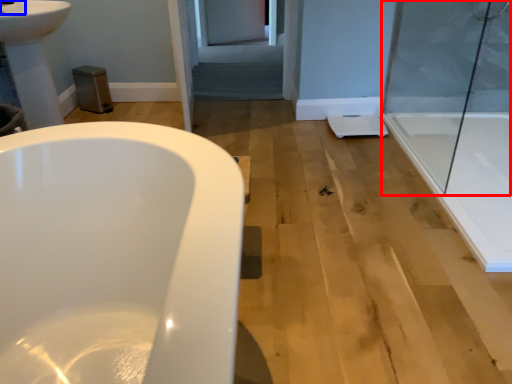
Question: Among these objects, which one is nearest to the camera, shower door (highlighted by a red box) or faucet (highlighted by a blue box)?

Choices:
 (A) shower door
 (B) faucet

Answer: (A)